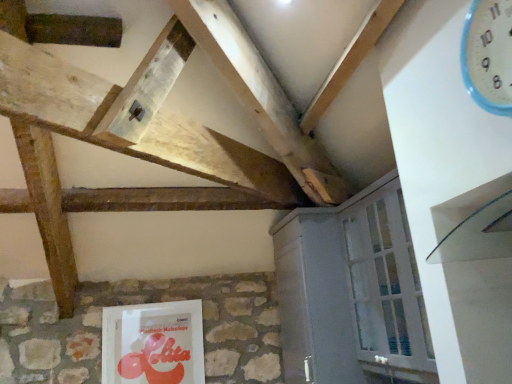
Question: Is there a large distance between matte plastic book at lower center and white plastic clock at upper right?

Choices:
 (A) no
 (B) yes

Answer: (B)

Question: Is matte plastic book at lower center not within white plastic clock at upper right?

Choices:
 (A) no
 (B) yes

Answer: (B)

Question: Can you confirm if matte plastic book at lower center is wider than white plastic clock at upper right?

Choices:
 (A) no
 (B) yes

Answer: (A)

Question: From a real-world perspective, is matte plastic book at lower center under white plastic clock at upper right?

Choices:
 (A) yes
 (B) no

Answer: (A)

Question: Considering the relative positions of matte plastic book at lower center and white plastic clock at upper right in the image provided, is matte plastic book at lower center behind white plastic clock at upper right?

Choices:
 (A) no
 (B) yes

Answer: (B)

Question: Can you confirm if matte plastic book at lower center is taller than white plastic clock at upper right?

Choices:
 (A) no
 (B) yes

Answer: (B)

Question: Is white plastic clock at upper right next to matte plastic book at lower center?

Choices:
 (A) no
 (B) yes

Answer: (A)

Question: Considering the relative positions of white plastic clock at upper right and matte plastic book at lower center in the image provided, is white plastic clock at upper right to the left of matte plastic book at lower center from the viewer's perspective?

Choices:
 (A) no
 (B) yes

Answer: (A)

Question: Is the position of white plastic clock at upper right more distant than that of matte plastic book at lower center?

Choices:
 (A) yes
 (B) no

Answer: (B)

Question: From a real-world perspective, is white plastic clock at upper right located beneath matte plastic book at lower center?

Choices:
 (A) yes
 (B) no

Answer: (B)

Question: From a real-world perspective, is white plastic clock at upper right over matte plastic book at lower center?

Choices:
 (A) yes
 (B) no

Answer: (A)

Question: Is white plastic clock at upper right facing away from matte plastic book at lower center?

Choices:
 (A) yes
 (B) no

Answer: (B)

Question: Considering the relative positions of white painted wood cabinet at lower right and matte plastic book at lower center in the image provided, is white painted wood cabinet at lower right to the right of matte plastic book at lower center from the viewer's perspective?

Choices:
 (A) no
 (B) yes

Answer: (B)